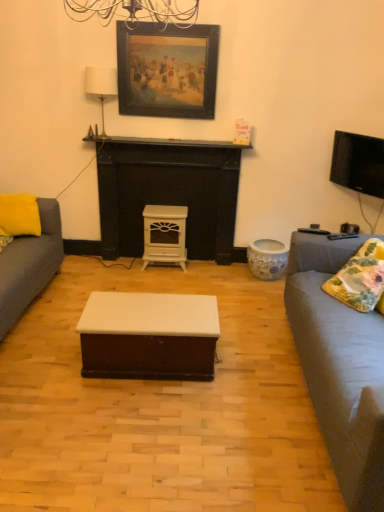
The image size is (384, 512). I want to click on vacant space underneath wooden picture frame at upper center (from a real-world perspective), so click(x=165, y=134).